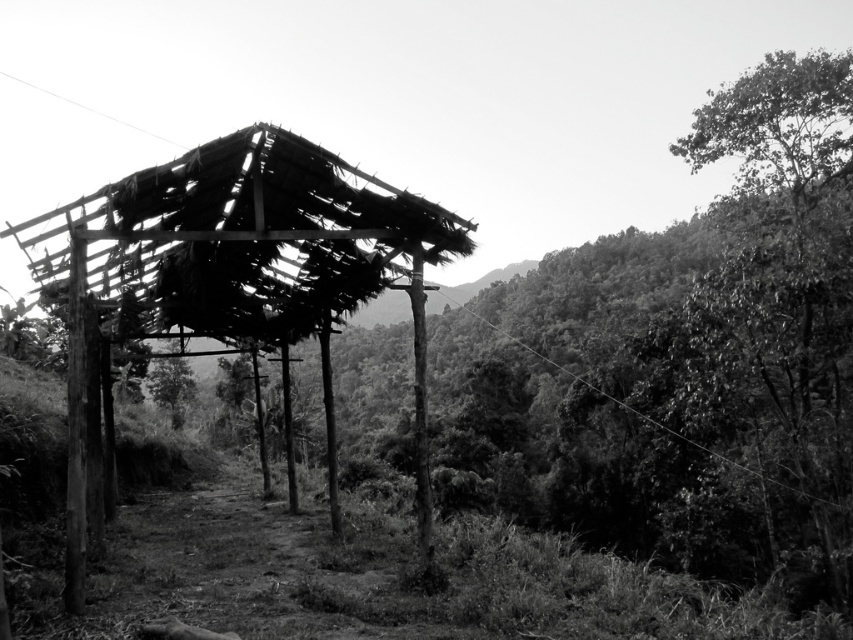
Question: Which of the following is the closest to the observer?

Choices:
 (A) dark green leafy tree at center
 (B) wooden pole at center

Answer: (B)

Question: Does wooden hut at center appear under wooden pole at center?

Choices:
 (A) no
 (B) yes

Answer: (A)

Question: Which is farther from the dark green leafy tree at center?

Choices:
 (A) wooden hut at center
 (B) wooden pole at center

Answer: (A)

Question: In this image, where is wooden hut at center located relative to dark green leafy tree at center?

Choices:
 (A) right
 (B) left

Answer: (A)

Question: Is wooden hut at center behind wooden pole at center?

Choices:
 (A) yes
 (B) no

Answer: (B)

Question: Which point is farther from the camera taking this photo?

Choices:
 (A) tap(338, 179)
 (B) tap(180, 419)

Answer: (B)